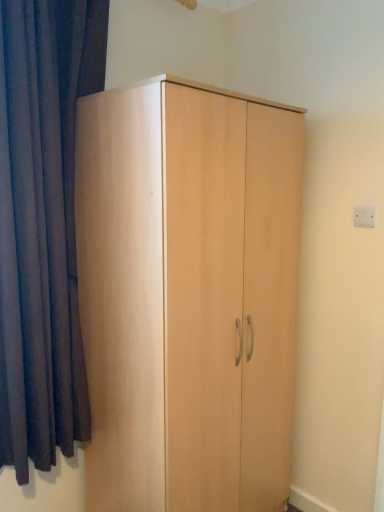
Locate an element on the screen. light wood wardrobe at center is located at coordinates (188, 295).

Identify the location of white plastic electric outlet at upper right. (364, 216).

The width and height of the screenshot is (384, 512). I want to click on light wood wardrobe at center, so click(188, 295).

Considering the sizes of dark blue fabric at left and light wood wardrobe at center in the image, is dark blue fabric at left wider or thinner than light wood wardrobe at center?

dark blue fabric at left is thinner than light wood wardrobe at center.

At what (x,y) coordinates should I click in order to perform the action: click on curtain above the light wood wardrobe at center (from the image's perspective). Please return your answer as a coordinate pair (x, y). The width and height of the screenshot is (384, 512). Looking at the image, I should click on (42, 224).

How many degrees apart are the facing directions of dark blue fabric at left and light wood wardrobe at center?

0.367 degrees separate the facing orientations of dark blue fabric at left and light wood wardrobe at center.

Is dark blue fabric at left not inside light wood wardrobe at center?

Yes, dark blue fabric at left is outside of light wood wardrobe at center.

Can dark blue fabric at left be found inside white plastic electric outlet at upper right?

Actually, dark blue fabric at left is outside white plastic electric outlet at upper right.

Is white plastic electric outlet at upper right taller or shorter than dark blue fabric at left?

Considering their sizes, white plastic electric outlet at upper right has less height than dark blue fabric at left.

Can you confirm if white plastic electric outlet at upper right is bigger than dark blue fabric at left?

No, white plastic electric outlet at upper right is not bigger than dark blue fabric at left.

Could you tell me if white plastic electric outlet at upper right is turned towards dark blue fabric at left?

No, white plastic electric outlet at upper right is not oriented towards dark blue fabric at left.

From the image's perspective, is light wood wardrobe at center above dark blue fabric at left?

Actually, light wood wardrobe at center appears below dark blue fabric at left in the image.

Between light wood wardrobe at center and dark blue fabric at left, which one has larger size?

Bigger between the two is light wood wardrobe at center.

Can you confirm if light wood wardrobe at center is wider than dark blue fabric at left?

Yes.

Is light wood wardrobe at center not within white plastic electric outlet at upper right?

Yes, light wood wardrobe at center is not within white plastic electric outlet at upper right.

Looking at this image, does light wood wardrobe at center have a greater width compared to white plastic electric outlet at upper right?

Correct, the width of light wood wardrobe at center exceeds that of white plastic electric outlet at upper right.

Between light wood wardrobe at center and white plastic electric outlet at upper right, which one appears on the left side from the viewer's perspective?

light wood wardrobe at center.

Are light wood wardrobe at center and white plastic electric outlet at upper right located far from each other?

No, light wood wardrobe at center is not far away from white plastic electric outlet at upper right.

Consider the image. Which object is further away from the camera taking this photo, white plastic electric outlet at upper right or light wood wardrobe at center?

white plastic electric outlet at upper right is further from the camera.

In the scene shown: Is white plastic electric outlet at upper right outside of light wood wardrobe at center?

That's correct, white plastic electric outlet at upper right is outside of light wood wardrobe at center.

From the image's perspective, who appears lower, white plastic electric outlet at upper right or light wood wardrobe at center?

light wood wardrobe at center is shown below in the image.

Considering the positions of objects dark blue fabric at left and white plastic electric outlet at upper right in the image provided, who is more to the left, dark blue fabric at left or white plastic electric outlet at upper right?

dark blue fabric at left is more to the left.

Is dark blue fabric at left not inside white plastic electric outlet at upper right?

Indeed, dark blue fabric at left is completely outside white plastic electric outlet at upper right.

Which point is more forward, [2,50] or [355,219]?

The point [2,50] is closer to the camera.

Find the location of a particular element. Image resolution: width=384 pixels, height=512 pixels. curtain on the left of light wood wardrobe at center is located at coordinates (42, 224).

The height and width of the screenshot is (512, 384). Find the location of `curtain that appears in front of the white plastic electric outlet at upper right`. curtain that appears in front of the white plastic electric outlet at upper right is located at coordinates (42, 224).

Estimate the real-world distances between objects in this image. Which object is further from white plastic electric outlet at upper right, dark blue fabric at left or light wood wardrobe at center?

Based on the image, dark blue fabric at left appears to be further to white plastic electric outlet at upper right.

Which object lies nearer to the anchor point dark blue fabric at left, white plastic electric outlet at upper right or light wood wardrobe at center?

light wood wardrobe at center is positioned closer to the anchor dark blue fabric at left.

Considering their positions, is light wood wardrobe at center positioned further to white plastic electric outlet at upper right than dark blue fabric at left?

Based on the image, dark blue fabric at left appears to be further to white plastic electric outlet at upper right.

Looking at the image, which one is located further to light wood wardrobe at center, dark blue fabric at left or white plastic electric outlet at upper right?

Among the two, white plastic electric outlet at upper right is located further to light wood wardrobe at center.

Based on their spatial positions, is white plastic electric outlet at upper right or dark blue fabric at left closer to light wood wardrobe at center?

Based on the image, dark blue fabric at left appears to be nearer to light wood wardrobe at center.

Estimate the real-world distances between objects in this image. Which object is further from dark blue fabric at left, light wood wardrobe at center or white plastic electric outlet at upper right?

Among the two, white plastic electric outlet at upper right is located further to dark blue fabric at left.

Image resolution: width=384 pixels, height=512 pixels. I want to click on cupboard between dark blue fabric at left and white plastic electric outlet at upper right from left to right, so click(x=188, y=295).